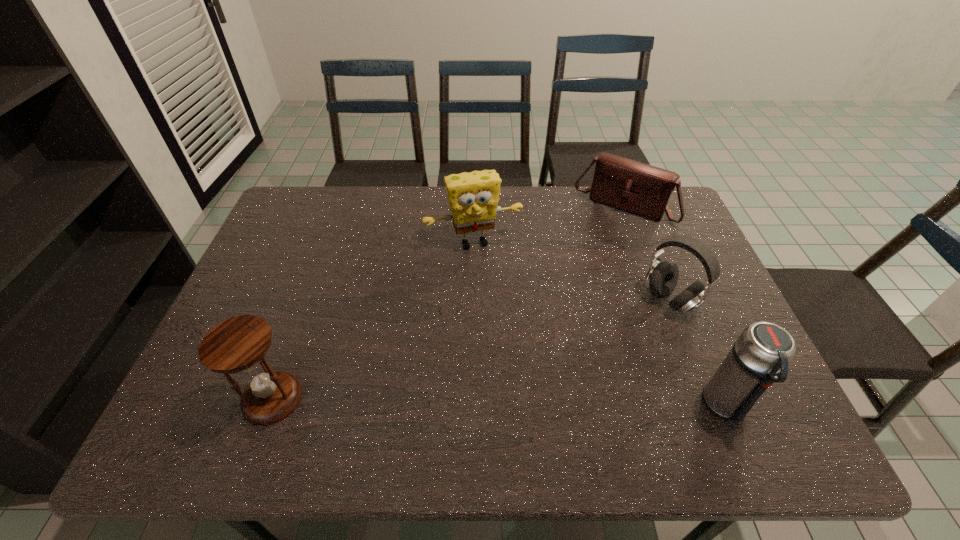
Find the location of `thermos bottle present at the right edge`. thermos bottle present at the right edge is located at coordinates (760, 356).

You are a GUI agent. You are given a task and a screenshot of the screen. Output one action in this format:
    pyautogui.click(x=<x>, y=<y>)
    Task: Click on the headset that is at the right edge
    
    Given the screenshot: What is the action you would take?
    pyautogui.click(x=662, y=277)

This screenshot has width=960, height=540. In order to click on shoulder bag situated at the right edge in this screenshot , I will do `click(637, 188)`.

Find the location of a particular element. The image size is (960, 540). object at the near left corner is located at coordinates (238, 344).

Where is `object at the far right corner`? Image resolution: width=960 pixels, height=540 pixels. object at the far right corner is located at coordinates (637, 188).

Where is `object present at the near right corner`? The width and height of the screenshot is (960, 540). object present at the near right corner is located at coordinates (760, 356).

In the image, there is a desktop. At what (x,y) coordinates should I click in order to perform the action: click on vacant space at the far edge. Please return your answer as a coordinate pair (x, y). Looking at the image, I should click on (354, 214).

Locate an element on the screen. The width and height of the screenshot is (960, 540). free spot at the near edge of the desktop is located at coordinates (660, 376).

Identify the location of vacant space at the left edge. The width and height of the screenshot is (960, 540). (300, 281).

In the image, there is a desktop. At what (x,y) coordinates should I click in order to perform the action: click on free space at the right edge. Please return your answer as a coordinate pair (x, y). The width and height of the screenshot is (960, 540). Looking at the image, I should click on (684, 339).